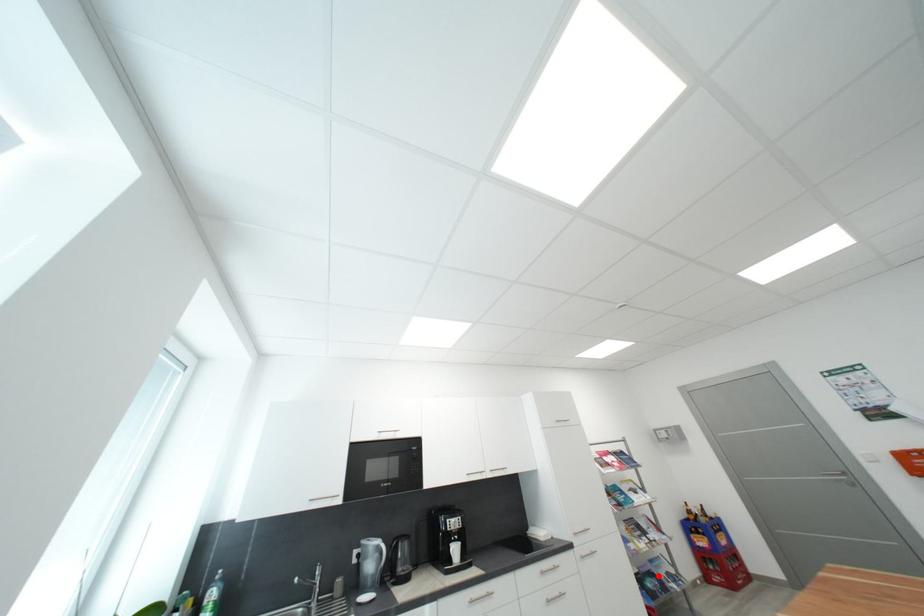
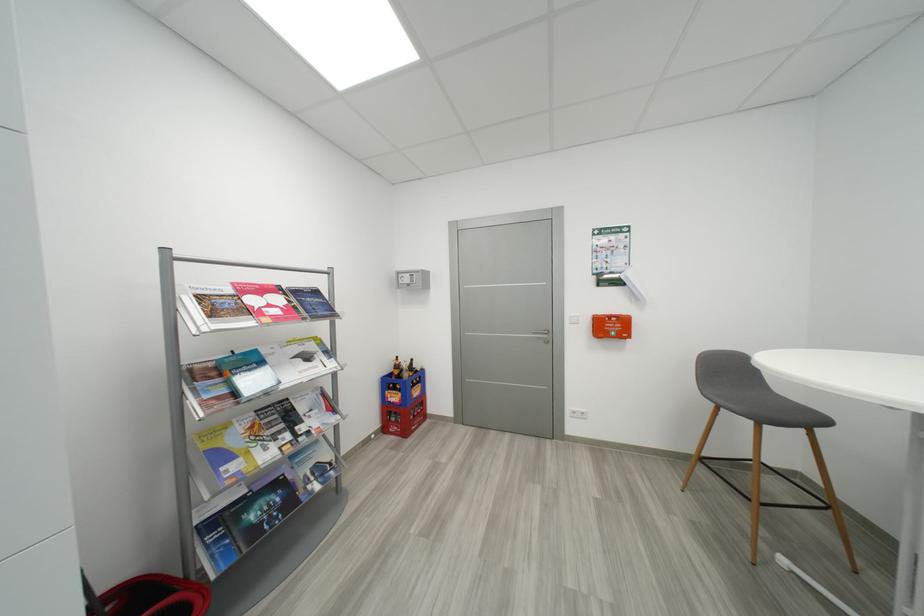
Locate, in the second image, the point that corresponds to the highlighted location in the first image.

(285, 485)